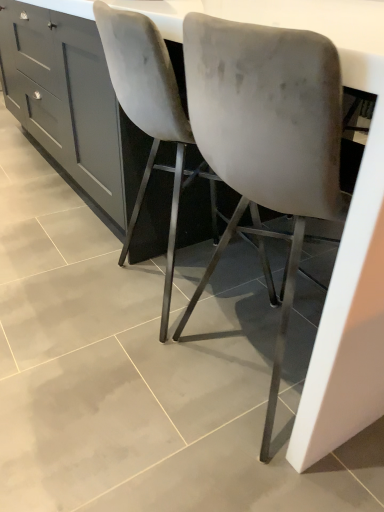
Question: Is matte gray cabinet at center not near white glossy counter at center?

Choices:
 (A) no
 (B) yes

Answer: (B)

Question: Is matte gray cabinet at center outside white glossy counter at center?

Choices:
 (A) yes
 (B) no

Answer: (B)

Question: Is matte gray cabinet at center behind white glossy counter at center?

Choices:
 (A) yes
 (B) no

Answer: (A)

Question: From the image's perspective, does matte gray cabinet at center appear lower than white glossy counter at center?

Choices:
 (A) no
 (B) yes

Answer: (A)

Question: Does matte gray cabinet at center have a lesser height compared to white glossy counter at center?

Choices:
 (A) no
 (B) yes

Answer: (B)

Question: In terms of size, does velvet-like gray chair at center, the 1th chair when ordered from left to right, appear bigger or smaller than matte gray cabinet at center?

Choices:
 (A) big
 (B) small

Answer: (B)

Question: Is velvet-like gray chair at center, which ranks as the 2th chair in right-to-left order, wider or thinner than matte gray cabinet at center?

Choices:
 (A) thin
 (B) wide

Answer: (A)

Question: From the image's perspective, is velvet-like gray chair at center, which ranks as the 2th chair in right-to-left order, positioned above or below matte gray cabinet at center?

Choices:
 (A) above
 (B) below

Answer: (B)

Question: From their relative heights in the image, would you say velvet-like gray chair at center, which ranks as the 2th chair in right-to-left order, is taller or shorter than matte gray cabinet at center?

Choices:
 (A) tall
 (B) short

Answer: (A)

Question: From a real-world perspective, is velvet grey chair at center, which ranks as the first chair in right-to-left order, physically located above or below white glossy counter at center?

Choices:
 (A) above
 (B) below

Answer: (A)

Question: From the image's perspective, relative to white glossy counter at center, is velvet grey chair at center, which ranks as the first chair in right-to-left order, above or below?

Choices:
 (A) above
 (B) below

Answer: (B)

Question: Is point (258, 228) closer or farther from the camera than point (377, 17)?

Choices:
 (A) closer
 (B) farther

Answer: (B)

Question: Looking at their shapes, would you say velvet grey chair at center, which ranks as the first chair in right-to-left order, is wider or thinner than white glossy counter at center?

Choices:
 (A) wide
 (B) thin

Answer: (B)

Question: Is white glossy counter at center spatially inside velvet-like gray chair at center, the 1th chair when ordered from left to right, or outside of it?

Choices:
 (A) inside
 (B) outside

Answer: (B)

Question: Considering the positions of white glossy counter at center and velvet-like gray chair at center, the 1th chair when ordered from left to right, in the image, is white glossy counter at center taller or shorter than velvet-like gray chair at center, the 1th chair when ordered from left to right,?

Choices:
 (A) tall
 (B) short

Answer: (A)